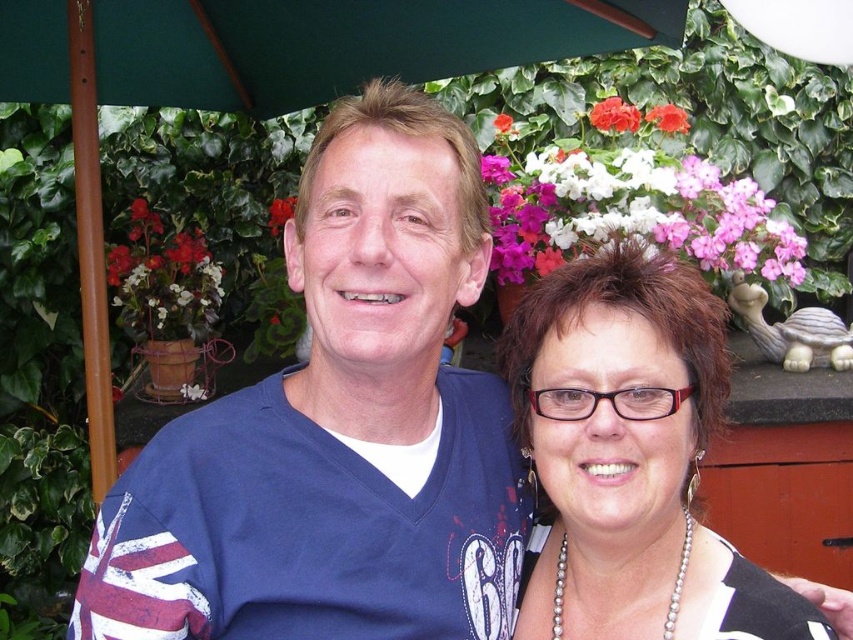
Question: Is matte red flower at upper left positioned at the back of matte white flower at upper center?

Choices:
 (A) no
 (B) yes

Answer: (A)

Question: Estimate the real-world distances between objects in this image. Which object is closer to the pearl necklace at center?

Choices:
 (A) matte white flower at upper center
 (B) matte red flower at upper left
 (C) pink matte flower at upper center
 (D) pink matte flowers at upper center

Answer: (D)

Question: Is pearl necklace at center further to camera compared to matte red flower at upper left?

Choices:
 (A) no
 (B) yes

Answer: (A)

Question: Which of the following is the farthest from the observer?

Choices:
 (A) pink matte flowers at upper center
 (B) pearl necklace at center

Answer: (A)

Question: Is pearl necklace at center positioned in front of matte white flower at upper center?

Choices:
 (A) yes
 (B) no

Answer: (A)

Question: Among these objects, which one is farthest from the camera?

Choices:
 (A) pearl necklace at center
 (B) matte white flower at upper center

Answer: (B)